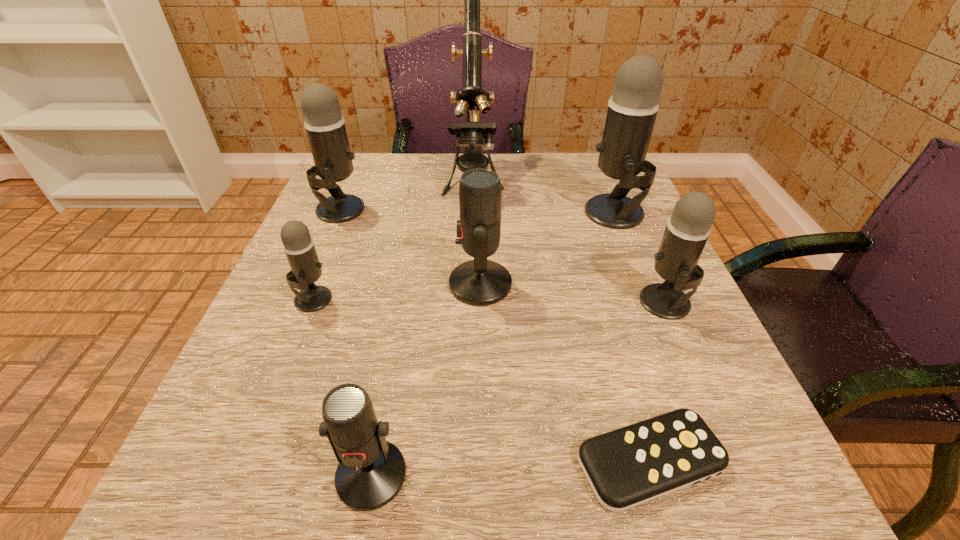
This screenshot has width=960, height=540. I want to click on the fourth microphone from right to left, so click(x=371, y=471).

Locate an element on the screen. The height and width of the screenshot is (540, 960). the shortest object is located at coordinates (626, 467).

The height and width of the screenshot is (540, 960). I want to click on vacant space situated through the eyepiece of the tallest object, so click(x=469, y=335).

Identify the location of vacant space situated 0.100m on the left of the biggest gray microphone. This screenshot has width=960, height=540. (540, 213).

I want to click on vacant space located 0.330m on the front of the second biggest gray microphone, so click(x=282, y=346).

This screenshot has height=540, width=960. I want to click on vacant space situated 0.290m on the side of the bigger red microphone with the red ring, so click(289, 284).

What are the coordinates of `free space located on the side of the bigger red microphone with the red ring` in the screenshot? It's located at (278, 284).

At what (x,y) coordinates should I click in order to perform the action: click on vacant space located on the side of the bigger red microphone with the red ring. Please return your answer as a coordinate pair (x, y). Image resolution: width=960 pixels, height=540 pixels. Looking at the image, I should click on (410, 284).

Locate an element on the screen. This screenshot has width=960, height=540. free location located 0.370m on the left of the second smallest gray microphone is located at coordinates tap(426, 302).

Find the location of a particular element. This screenshot has width=960, height=540. free space located on the front of the smallest gray microphone is located at coordinates (230, 507).